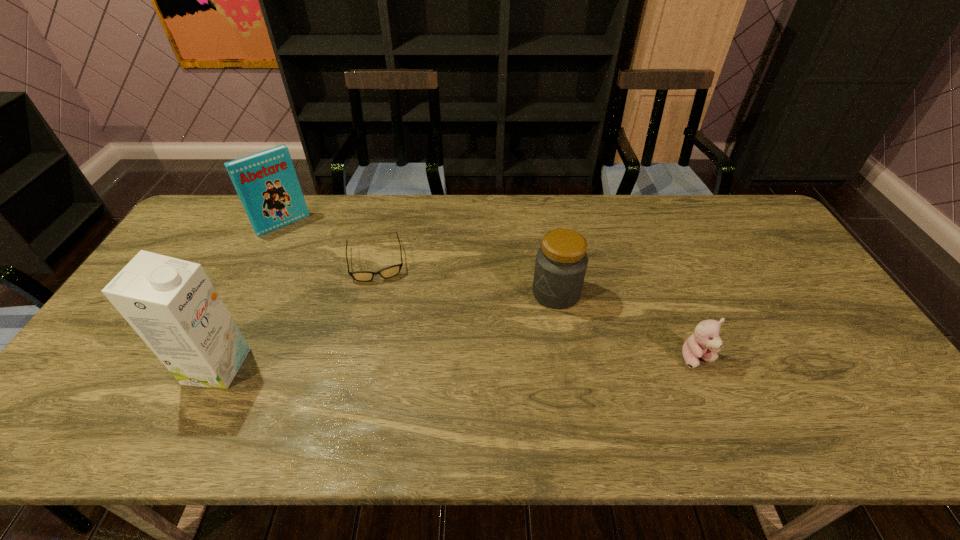
Where is `carton at the near edge`? The image size is (960, 540). carton at the near edge is located at coordinates pyautogui.click(x=172, y=305).

Where is `teddy bear at the near edge`? teddy bear at the near edge is located at coordinates (705, 342).

Locate an element on the screen. vacant space at the far edge of the desktop is located at coordinates coord(393,209).

Locate an element on the screen. The image size is (960, 540). vacant area at the near edge of the desktop is located at coordinates 287,401.

This screenshot has height=540, width=960. Identify the location of free space at the left edge. (108, 336).

In the image, there is a desktop. Where is `vacant space at the far right corner`? The height and width of the screenshot is (540, 960). vacant space at the far right corner is located at coordinates (720, 206).

Where is `free spot between the fourth tallest object and the carton`? This screenshot has height=540, width=960. free spot between the fourth tallest object and the carton is located at coordinates (457, 362).

This screenshot has height=540, width=960. I want to click on vacant area between the second shortest object and the shortest object, so click(537, 309).

Where is `free space between the third object from right to left and the tallest object`? The image size is (960, 540). free space between the third object from right to left and the tallest object is located at coordinates (297, 313).

The image size is (960, 540). Find the location of `free spot between the farthest object and the sunglasses`. free spot between the farthest object and the sunglasses is located at coordinates (329, 242).